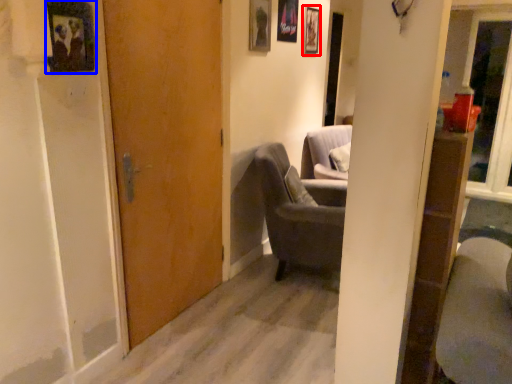
Question: Which point is closer to the camera, picture frame (highlighted by a red box) or picture frame (highlighted by a blue box)?

Choices:
 (A) picture frame
 (B) picture frame

Answer: (B)